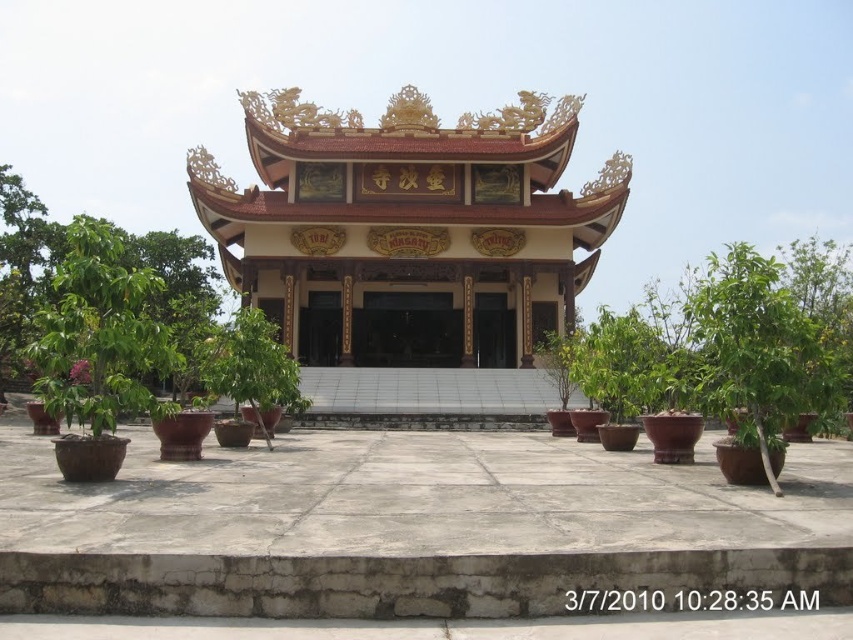
Does green glossy tree at center appear on the left side of green leafy tree at left?

No, green glossy tree at center is not to the left of green leafy tree at left.

Which is more to the right, green glossy tree at center or green leafy tree at left?

Positioned to the right is green glossy tree at center.

Who is more distant from viewer, (734,417) or (86,321)?

The point (86,321) is more distant.

Where is `green glossy tree at center`? green glossy tree at center is located at coordinates (721, 355).

How distant is white glossy pagoda at center from green glossy tree at center?

white glossy pagoda at center is 28.52 meters away from green glossy tree at center.

Is white glossy pagoda at center closer to camera compared to green glossy tree at center?

No.

The image size is (853, 640). I want to click on white glossy pagoda at center, so click(x=409, y=228).

Who is higher up, white glossy pagoda at center or green leafy tree at left?

white glossy pagoda at center is higher up.

Who is shorter, white glossy pagoda at center or green leafy tree at left?

Standing shorter between the two is green leafy tree at left.

Is point (550, 241) positioned behind point (126, 410)?

Yes, point (550, 241) is farther from viewer.

The width and height of the screenshot is (853, 640). I want to click on white glossy pagoda at center, so click(409, 228).